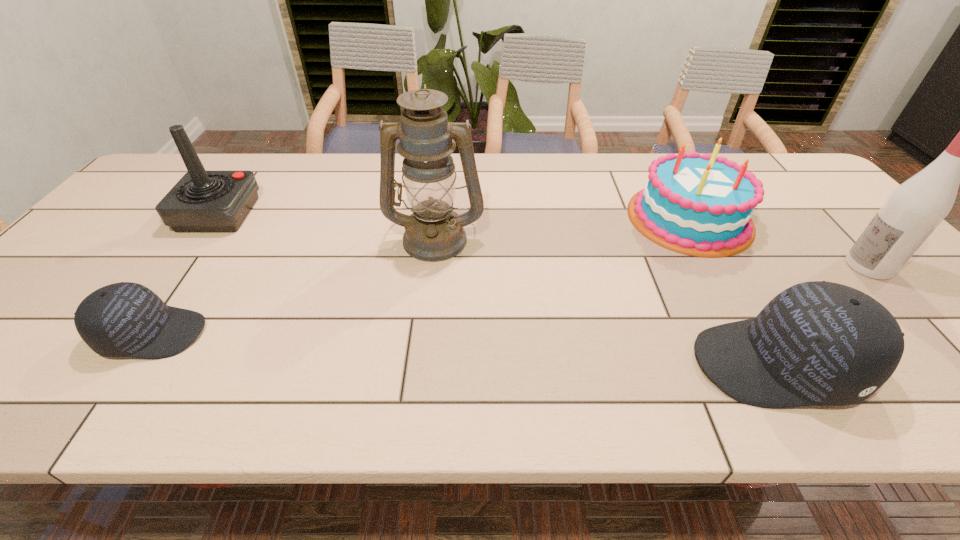
You are a GUI agent. You are given a task and a screenshot of the screen. Output one action in this format:
    pyautogui.click(x=<x>, y=<y>)
    Task: Click on the vacant space at the near edge
    Image resolution: width=960 pixels, height=540 pixels.
    Given the screenshot: What is the action you would take?
    pyautogui.click(x=605, y=353)

This screenshot has height=540, width=960. I want to click on free spot at the left edge of the desktop, so click(58, 270).

Where is `vacant space at the right edge of the desktop`? This screenshot has height=540, width=960. vacant space at the right edge of the desktop is located at coordinates (805, 232).

You are a GUI agent. You are given a task and a screenshot of the screen. Output one action in this format:
    pyautogui.click(x=<x>, y=<y>)
    Task: Click on the free region at the far left corner of the desktop
    This screenshot has height=540, width=960.
    Given the screenshot: What is the action you would take?
    pyautogui.click(x=212, y=159)

Locate an element on the screen. vacant space at the far right corner is located at coordinates (751, 161).

You are a GUI agent. You are given a task and a screenshot of the screen. Output one action in this format:
    pyautogui.click(x=<x>, y=<y>)
    Task: Click on the free space at the near right corner of the desktop
    
    Given the screenshot: What is the action you would take?
    pyautogui.click(x=928, y=332)

Where is `empty location between the joystick and the shorter baseball cap`? empty location between the joystick and the shorter baseball cap is located at coordinates click(x=186, y=274).

You are a GUI agent. You are given a task and a screenshot of the screen. Output one action in this format:
    pyautogui.click(x=<x>, y=<y>)
    Task: Click on the vacant area that lies between the joystick and the shortest object
    
    Given the screenshot: What is the action you would take?
    pyautogui.click(x=186, y=274)

Find the location of a particular element. Image resolution: width=960 pixels, height=540 pixels. vacant point located between the rightmost object and the birthday cake is located at coordinates (779, 242).

The width and height of the screenshot is (960, 540). I want to click on free space between the birthday cake and the taller baseball cap, so click(732, 291).